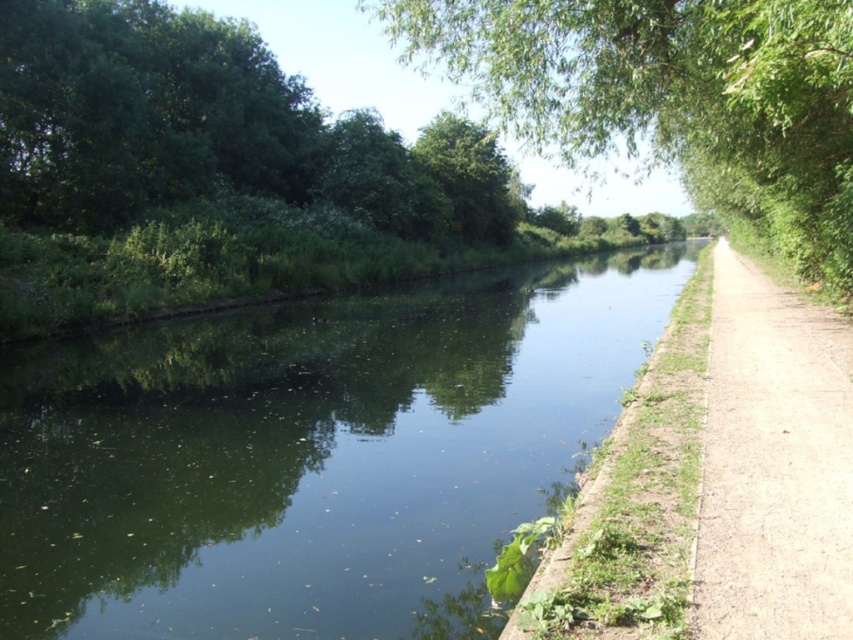
Question: Considering the relative positions of green leafy tree at center and dirt path at right in the image provided, where is green leafy tree at center located with respect to dirt path at right?

Choices:
 (A) above
 (B) below

Answer: (A)

Question: Which point is farther to the camera?

Choices:
 (A) green leafy tree at center
 (B) green reflective water at center
 (C) dirt path at right

Answer: (A)

Question: Is green reflective water at center further to camera compared to green leafy tree at center?

Choices:
 (A) no
 (B) yes

Answer: (A)

Question: Does green leafy tree at center have a larger size compared to dirt path at right?

Choices:
 (A) yes
 (B) no

Answer: (A)

Question: Based on their relative distances, which object is nearer to the green reflective water at center?

Choices:
 (A) dirt path at right
 (B) green leafy tree at center

Answer: (A)

Question: Estimate the real-world distances between objects in this image. Which object is farther from the green leafy tree at center?

Choices:
 (A) dirt path at right
 (B) green reflective water at center

Answer: (A)